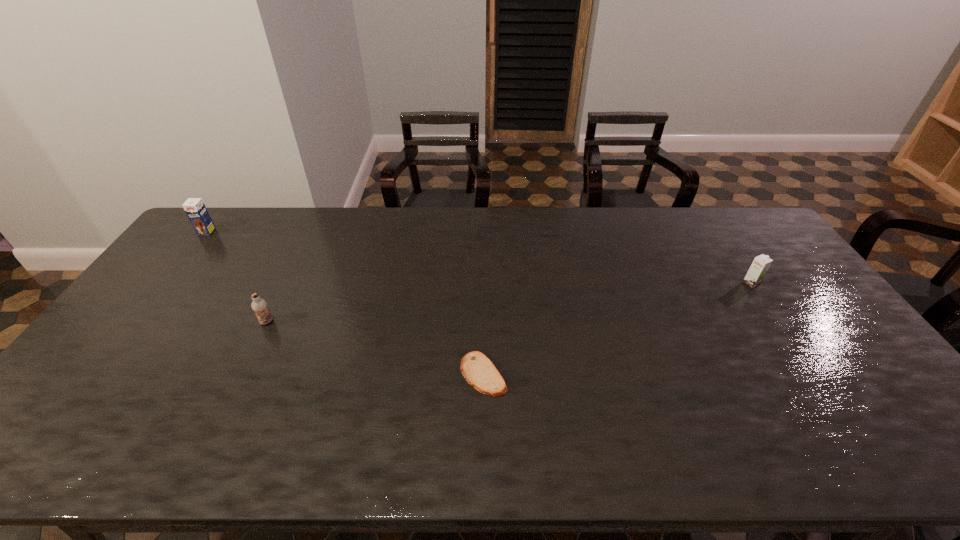
The image size is (960, 540). I want to click on the farthest chocolate milk, so click(x=195, y=209).

The height and width of the screenshot is (540, 960). Identify the location of the leftmost object. (195, 209).

This screenshot has height=540, width=960. Find the location of `the nearest chocolate milk`. the nearest chocolate milk is located at coordinates (259, 306).

This screenshot has height=540, width=960. In order to click on the second chocolate milk from right to left in this screenshot , I will do `click(259, 306)`.

Find the location of a particular element. the rightmost chocolate milk is located at coordinates (758, 269).

The width and height of the screenshot is (960, 540). Identify the location of the second farthest chocolate milk. (758, 269).

Find the location of a particular element. the third object from left to right is located at coordinates (477, 369).

This screenshot has width=960, height=540. I want to click on the nearest object, so click(477, 369).

Find the location of `vacant point located on the front label of the leftmost chocolate milk`. vacant point located on the front label of the leftmost chocolate milk is located at coordinates (169, 281).

Where is `vacant point located on the back of the third farthest object`? vacant point located on the back of the third farthest object is located at coordinates (291, 272).